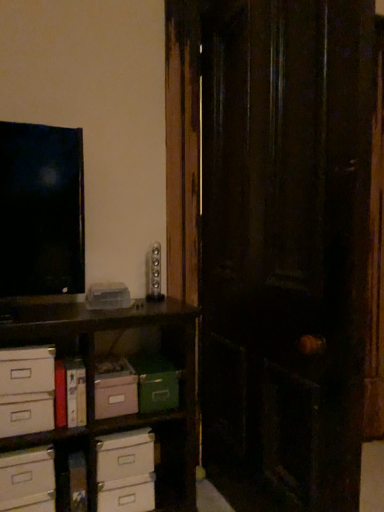
Identify the location of dark wood door at center. (274, 238).

The image size is (384, 512). I want to click on white cardboard chest of drawers at lower left, so click(x=27, y=390).

What are the coordinates of `white cardboard drawer at lower left, the first drawer in the top-to-bottom sequence` in the screenshot? It's located at (27, 376).

The width and height of the screenshot is (384, 512). In order to click on white cardboard drawer at lower left, the first drawer from the bottom in this screenshot , I will do `click(28, 480)`.

Image resolution: width=384 pixels, height=512 pixels. What do you see at coordinates (156, 383) in the screenshot?
I see `green matte storage box at center, the second storage box when ordered from left to right` at bounding box center [156, 383].

How much space does green matte storage box at center, which appears as the first storage box when viewed from the right, occupy horizontally?

The width of green matte storage box at center, which appears as the first storage box when viewed from the right, is 9.54 inches.

The height and width of the screenshot is (512, 384). Find the location of `dark wood door at center`. dark wood door at center is located at coordinates click(x=274, y=238).

Does hardcover book at lower left have a greater height compared to white cardboard drawer at lower left, the second drawer positioned from the top?

Correct, hardcover book at lower left is much taller as white cardboard drawer at lower left, the second drawer positioned from the top.

Could you tell me if hardcover book at lower left is facing white cardboard drawer at lower left, which is counted as the second drawer, starting from the bottom?

No, hardcover book at lower left is not aimed at white cardboard drawer at lower left, which is counted as the second drawer, starting from the bottom.

Is hardcover book at lower left not inside white cardboard drawer at lower left, which is counted as the second drawer, starting from the bottom?

hardcover book at lower left lies outside white cardboard drawer at lower left, which is counted as the second drawer, starting from the bottom,'s area.

Can you tell me how much hardcover book at lower left and white cardboard drawer at lower left, which is counted as the second drawer, starting from the bottom, differ in facing direction?

hardcover book at lower left and white cardboard drawer at lower left, which is counted as the second drawer, starting from the bottom, are facing 1.48 degrees away from each other.

How far apart are white cardboard chest of drawers at lower left and white cardboard boxes at lower left?

white cardboard chest of drawers at lower left is 7.99 inches away from white cardboard boxes at lower left.

Is white cardboard chest of drawers at lower left thinner than white cardboard boxes at lower left?

Correct, the width of white cardboard chest of drawers at lower left is less than that of white cardboard boxes at lower left.

Considering the points (11, 389) and (117, 421), which point is behind, point (11, 389) or point (117, 421)?

The point (117, 421) is behind.

At what (x,y) coordinates should I click in order to perform the action: click on shelf below the white cardboard chest of drawers at lower left (from the image's perspective). Please return your answer as a coordinate pair (x, y). This screenshot has width=384, height=512. Looking at the image, I should click on (94, 374).

Is white cardboard drawer at lower left, the first drawer in the top-to-bottom sequence, a part of white cardboard chest of drawers at lower left?

Definitely not — white cardboard drawer at lower left, the first drawer in the top-to-bottom sequence, is not inside white cardboard chest of drawers at lower left.

Are white cardboard chest of drawers at lower left and white cardboard drawer at lower left, which is the 3th drawer from bottom to top, far apart?

No, white cardboard chest of drawers at lower left is not far away from white cardboard drawer at lower left, which is the 3th drawer from bottom to top.

Does white cardboard chest of drawers at lower left have a greater width compared to white cardboard drawer at lower left, the first drawer in the top-to-bottom sequence?

Incorrect, the width of white cardboard chest of drawers at lower left does not surpass that of white cardboard drawer at lower left, the first drawer in the top-to-bottom sequence.

Considering the points (99, 397) and (15, 374), which point is behind, point (99, 397) or point (15, 374)?

The point (99, 397) is farther.

Is white cardboard drawer at lower left, the first drawer in the top-to-bottom sequence, at the back of pastel pink cardboard storage box at center-left, placed as the second storage box when sorted from right to left?

pastel pink cardboard storage box at center-left, placed as the second storage box when sorted from right to left, does not have its back to white cardboard drawer at lower left, the first drawer in the top-to-bottom sequence.

Does pastel pink cardboard storage box at center-left, the first storage box viewed from the left, come behind white cardboard drawer at lower left, which is the 3th drawer from bottom to top?

Yes, pastel pink cardboard storage box at center-left, the first storage box viewed from the left, is further from the camera.

Who is bigger, pastel pink cardboard storage box at center-left, the first storage box viewed from the left, or white cardboard drawer at lower left, the first drawer in the top-to-bottom sequence?

pastel pink cardboard storage box at center-left, the first storage box viewed from the left.

Measure the distance between white cardboard drawer at lower left, the second drawer positioned from the top, and dark wood door at center.

white cardboard drawer at lower left, the second drawer positioned from the top, is 32.70 inches away from dark wood door at center.

Which is less distant, (105, 447) or (186, 180)?

Point (105, 447) is closer to the camera than point (186, 180).

Considering the sizes of objects white cardboard drawer at lower left, the second drawer positioned from the top, and dark wood door at center in the image provided, who is bigger, white cardboard drawer at lower left, the second drawer positioned from the top, or dark wood door at center?

dark wood door at center.

Is white cardboard drawer at lower left, the first drawer from the bottom, thinner than dark wood door at center?

Correct, the width of white cardboard drawer at lower left, the first drawer from the bottom, is less than that of dark wood door at center.

Considering the relative sizes of white cardboard drawer at lower left, which ranks as the 3th drawer in top-to-bottom order, and dark wood door at center in the image provided, is white cardboard drawer at lower left, which ranks as the 3th drawer in top-to-bottom order, shorter than dark wood door at center?

Yes.

This screenshot has width=384, height=512. There is a dark wood door at center. In order to click on the 3rd drawer below it (from the image's perspective) in this screenshot , I will do `click(28, 480)`.

Between point (6, 377) and point (154, 370), which one is positioned behind?

The point (154, 370) is behind.

Would you say white cardboard drawer at lower left, which is the 3th drawer from bottom to top, is outside green matte storage box at center, which appears as the first storage box when viewed from the right?

Yes, white cardboard drawer at lower left, which is the 3th drawer from bottom to top, is not within green matte storage box at center, which appears as the first storage box when viewed from the right.

From the image's perspective, is white cardboard drawer at lower left, the first drawer in the top-to-bottom sequence, on top of green matte storage box at center, the second storage box when ordered from left to right?

Yes, from the image's perspective, white cardboard drawer at lower left, the first drawer in the top-to-bottom sequence, is over green matte storage box at center, the second storage box when ordered from left to right.

Is white cardboard drawer at lower left, which is the 3th drawer from bottom to top, shorter than green matte storage box at center, the second storage box when ordered from left to right?

→ Indeed, white cardboard drawer at lower left, which is the 3th drawer from bottom to top, has a lesser height compared to green matte storage box at center, the second storage box when ordered from left to right.

Identify the location of drawer behind the hardcover book at lower left. Image resolution: width=384 pixels, height=512 pixels. (125, 454).

Where is `shelf below the white cardboard chest of drawers at lower left (from the image's perspective)`? This screenshot has width=384, height=512. shelf below the white cardboard chest of drawers at lower left (from the image's perspective) is located at coordinates (94, 374).

Based on their spatial positions, is white cardboard drawer at lower left, which ranks as the 3th drawer in top-to-bottom order, or white cardboard boxes at lower left further from white cardboard drawer at lower left, which is the 3th drawer from bottom to top?

white cardboard boxes at lower left is positioned further to the anchor white cardboard drawer at lower left, which is the 3th drawer from bottom to top.

In the scene shown: When comparing their distances from hardcover book at lower left, does white cardboard boxes at lower left or white cardboard drawer at lower left, the first drawer in the top-to-bottom sequence, seem further?

The object further to hardcover book at lower left is white cardboard boxes at lower left.

When comparing their distances from dark wood door at center, does green matte storage box at center, the second storage box when ordered from left to right, or white cardboard drawer at lower left, the first drawer in the top-to-bottom sequence, seem further?

white cardboard drawer at lower left, the first drawer in the top-to-bottom sequence, is positioned further to the anchor dark wood door at center.

Estimate the real-world distances between objects in this image. Which object is further from white cardboard drawer at lower left, the first drawer in the top-to-bottom sequence, white cardboard drawer at lower left, which is counted as the second drawer, starting from the bottom, or white cardboard drawer at lower left, which ranks as the 3th drawer in top-to-bottom order?

The object further to white cardboard drawer at lower left, the first drawer in the top-to-bottom sequence, is white cardboard drawer at lower left, which is counted as the second drawer, starting from the bottom.

Based on their spatial positions, is green matte storage box at center, which appears as the first storage box when viewed from the right, or white cardboard chest of drawers at lower left closer to white cardboard drawer at lower left, which is the 3th drawer from bottom to top?

The object closer to white cardboard drawer at lower left, which is the 3th drawer from bottom to top, is white cardboard chest of drawers at lower left.

When comparing their distances from dark wood door at center, does white cardboard drawer at lower left, the first drawer in the top-to-bottom sequence, or white cardboard boxes at lower left seem further?

Based on the image, white cardboard drawer at lower left, the first drawer in the top-to-bottom sequence, appears to be further to dark wood door at center.

Estimate the real-world distances between objects in this image. Which object is closer to white cardboard drawer at lower left, which ranks as the 3th drawer in top-to-bottom order, green matte storage box at center, the second storage box when ordered from left to right, or dark wood door at center?

green matte storage box at center, the second storage box when ordered from left to right, is positioned closer to the anchor white cardboard drawer at lower left, which ranks as the 3th drawer in top-to-bottom order.

From the image, which object appears to be farther from white cardboard boxes at lower left, dark wood door at center or white cardboard drawer at lower left, which is the 3th drawer from bottom to top?

dark wood door at center lies further to white cardboard boxes at lower left than the other object.

You are a GUI agent. You are given a task and a screenshot of the screen. Output one action in this format:
    pyautogui.click(x=<x>, y=<y>)
    Task: Click on the book between white cardboard drawer at lower left, which is the 3th drawer from bottom to top, and white cardboard drawer at lower left, which ranks as the 3th drawer in top-to-bottom order, from top to bottom
    The height and width of the screenshot is (512, 384).
    Given the screenshot: What is the action you would take?
    pyautogui.click(x=76, y=392)

The width and height of the screenshot is (384, 512). Identify the location of book located between white cardboard chest of drawers at lower left and white cardboard boxes at lower left in the left-right direction. (76, 392).

The image size is (384, 512). Identify the location of storage box between green matte storage box at center, which appears as the first storage box when viewed from the right, and white cardboard drawer at lower left, which is counted as the second drawer, starting from the bottom, from top to bottom. (115, 388).

This screenshot has height=512, width=384. In order to click on storage box situated between white cardboard chest of drawers at lower left and green matte storage box at center, which appears as the first storage box when viewed from the right, from left to right in this screenshot , I will do `click(115, 388)`.